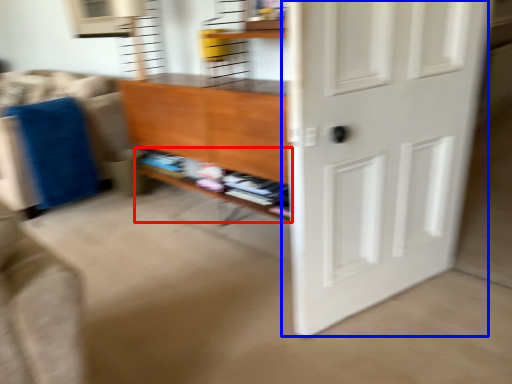
Question: Which object is closer to the camera taking this photo, shelf (highlighted by a red box) or door (highlighted by a blue box)?

Choices:
 (A) shelf
 (B) door

Answer: (B)